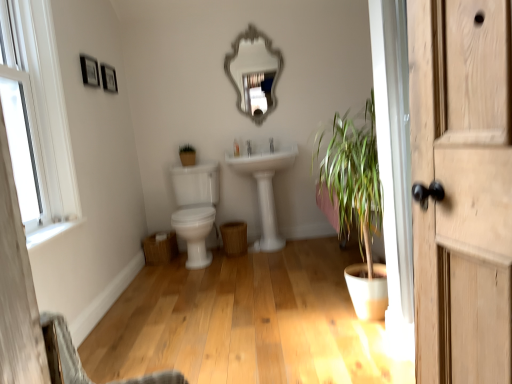
Question: From a real-world perspective, is white wooden window at upper left positioned above or below matte black picture frame at upper left, which is the 2th picture frame in front-to-back order?

Choices:
 (A) below
 (B) above

Answer: (A)

Question: Is point (28, 11) closer or farther from the camera than point (106, 79)?

Choices:
 (A) farther
 (B) closer

Answer: (B)

Question: Considering the real-world distances, which object is closest to the white glossy faucet at center?

Choices:
 (A) white glossy sink at center
 (B) matte black picture frame at upper left, which is the 2th picture frame in front-to-back order
 (C) silver metallic mirror at upper center
 (D) white wooden window at upper left
 (E) wooden picture frame at upper left, the 1th picture frame from the front

Answer: (A)

Question: Which object is the farthest from the silver metallic mirror at upper center?

Choices:
 (A) white glossy sink at center
 (B) wooden picture frame at upper left, the 1th picture frame from the front
 (C) white wooden window at upper left
 (D) white glossy faucet at center
 (E) matte black picture frame at upper left, which appears as the first picture frame when viewed from the back

Answer: (C)